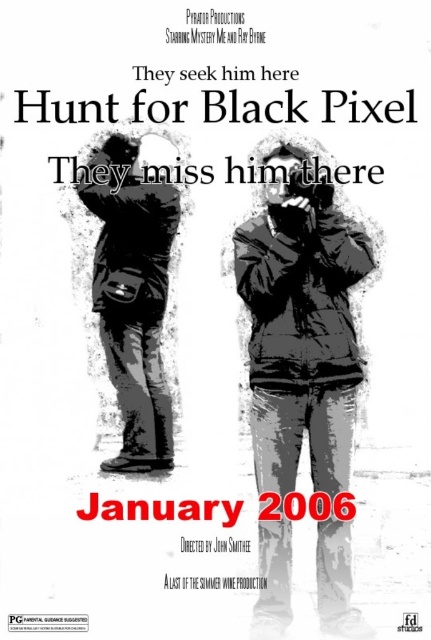
Is point (262, 352) in front of point (100, 164)?

That is True.

Consider the image. Is denim jacket at center thinner than matte black bag at left?

Incorrect, denim jacket at center's width is not less than matte black bag at left's.

What do you see at coordinates (300, 337) in the screenshot?
I see `denim jacket at center` at bounding box center [300, 337].

What are the coordinates of `denim jacket at center` in the screenshot? It's located at (300, 337).